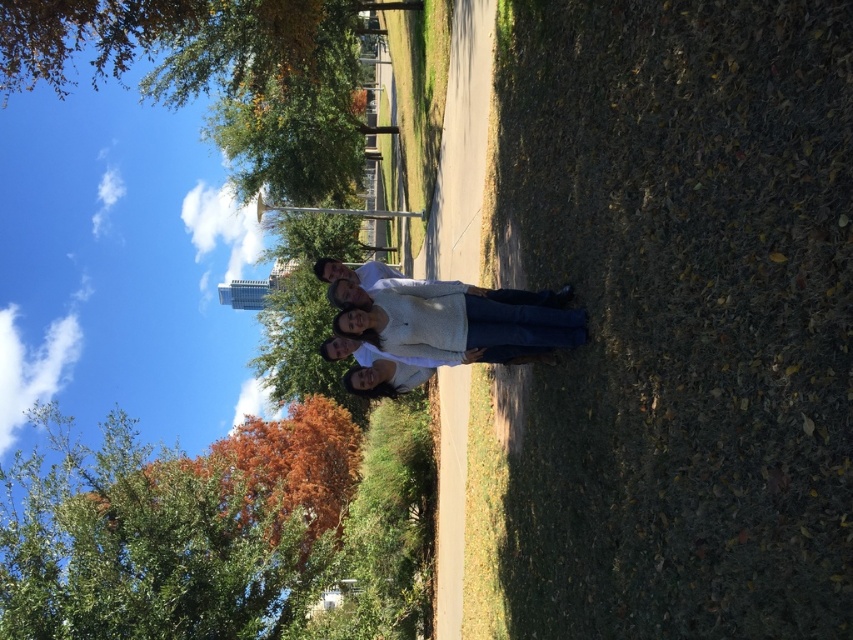
You are taking a photo of the group in the park. The two points you are focusing on are point (357,314) and point (346,280). Which point should you focus on to ensure the subject in front is clearer?

Point (357,314) is closer to the camera than point (346,280), so focusing on point (357,314) will ensure the subject in front is clearer.

In the scene shown: You are standing at the origin point in the park scene. The green leafy tree at center is located at point 0.836, 0.220. If you want to walk directly towards the tree, which direction should you head?

The green leafy tree at center is located at point (187, 534), so you should head towards the northeast direction to reach it.